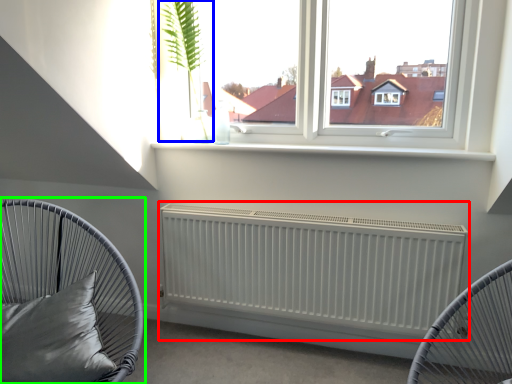
Question: Considering the real-world distances, which object is closest to radiator (highlighted by a red box)? plant (highlighted by a blue box) or furniture (highlighted by a green box).

Choices:
 (A) plant
 (B) furniture

Answer: (B)